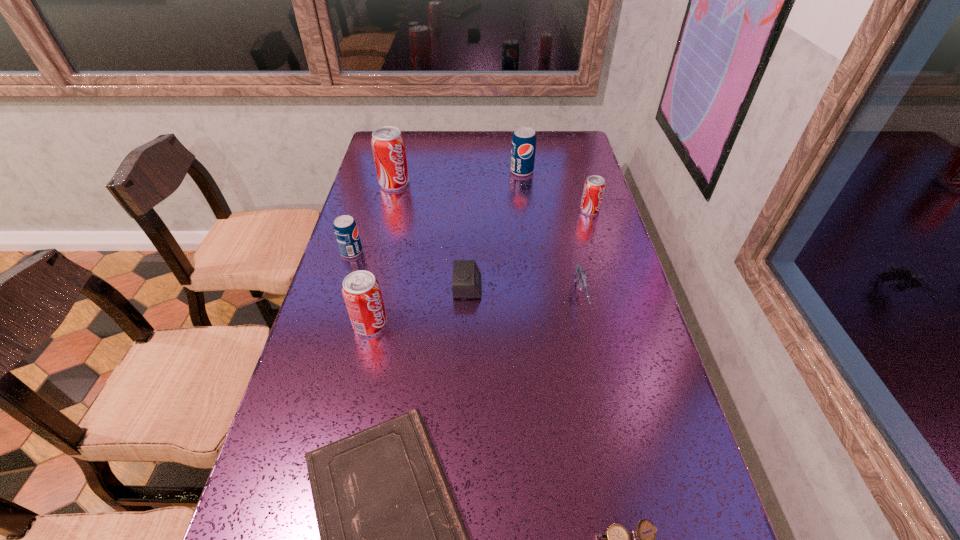
Find the location of a particular element. This screenshot has width=960, height=540. free space between the sixth nearest object and the biggest red soda can is located at coordinates (373, 218).

Where is `vacant space that's between the fourth pop from left to right and the biggest red soda can`? This screenshot has width=960, height=540. vacant space that's between the fourth pop from left to right and the biggest red soda can is located at coordinates (458, 177).

This screenshot has height=540, width=960. In order to click on object that is the nearest to the third shortest object in this screenshot , I will do (x=361, y=290).

The width and height of the screenshot is (960, 540). In order to click on object that ranks as the fourth closest to the seventh tallest object in this screenshot , I will do `click(392, 539)`.

Image resolution: width=960 pixels, height=540 pixels. I want to click on pop that stands as the closest to the rightmost pop, so click(x=523, y=148).

Find the location of a particular element. The image size is (960, 540). pop that stands as the second closest to the second biggest red soda can is located at coordinates (388, 146).

This screenshot has width=960, height=540. I want to click on red soda can that is the third closest one to the right blue pop, so click(361, 290).

Identify which red soda can is the second nearest to the second shortest object. Please provide its 2D coordinates. Your answer should be formatted as a tuple, i.e. [(x, y)], where the tuple contains the x and y coordinates of a point satisfying the conditions above.

[(594, 186)]